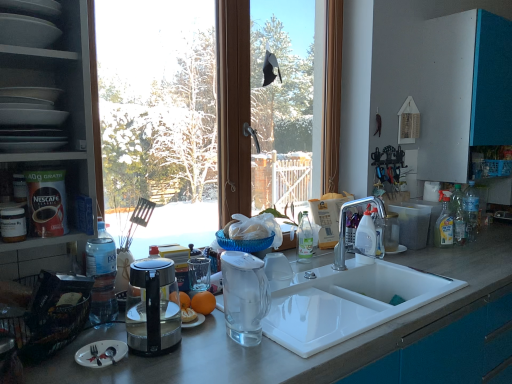
You are a GUI agent. You are given a task and a screenshot of the screen. Output one action in this format:
    pyautogui.click(x=<x>, y=<y>)
    Task: Click on the free spot to the right of orange matte at center
    This screenshot has width=512, height=384.
    Given the screenshot: What is the action you would take?
    pyautogui.click(x=269, y=317)